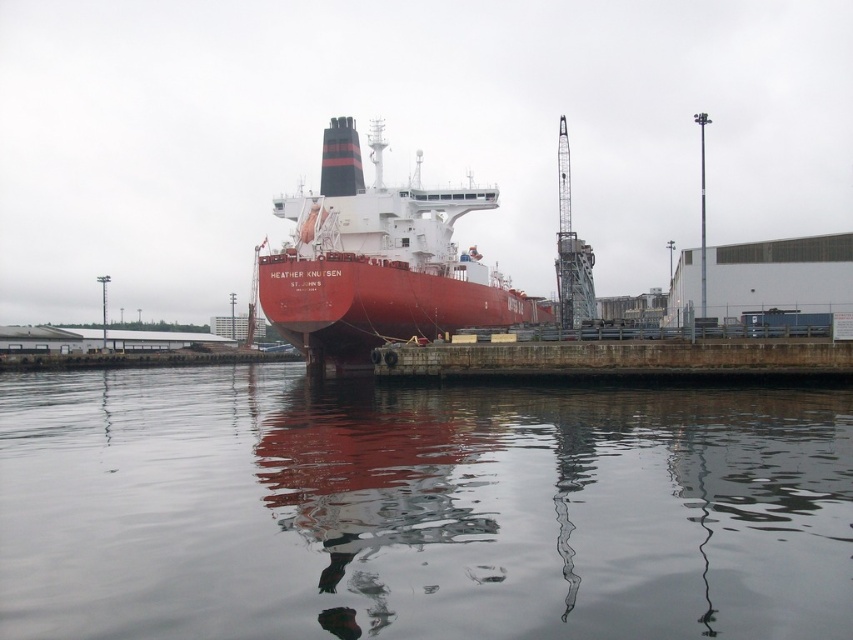
You are standing on the dock and looking at the scene. Which object is closer to you between the smooth water at center and the matte red ship at center?

The smooth water at center is closer to the viewer than the matte red ship at center.